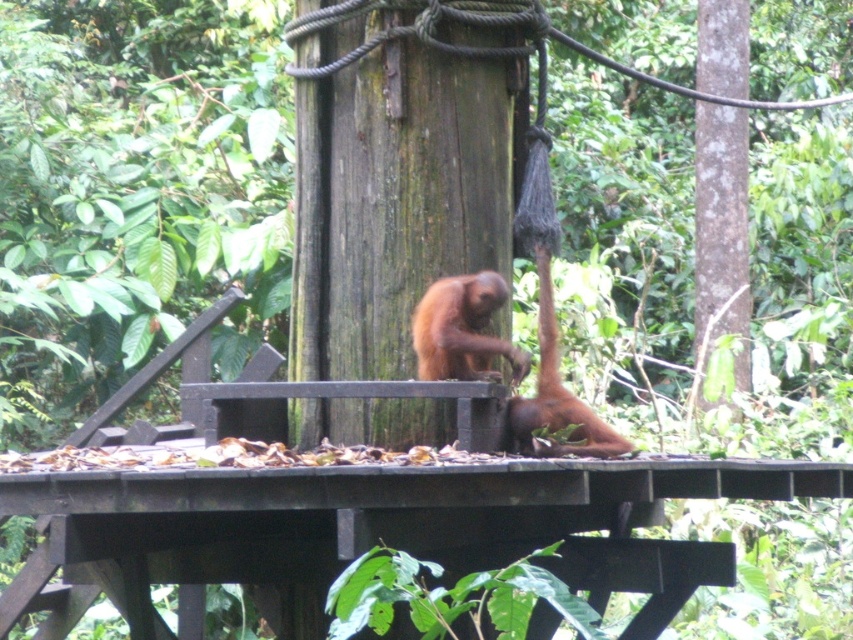
You are a researcher observing the forest scene. You notice an object at coordinates point (462,330). What is located at that point?

The orange fur monkey at center is located at point (462,330).

Looking at this image, you are a visitor at the forest platform and want to take a photo of both monkeys. Which monkey is higher up, the orange fur monkey at center or the brown fur monkey at center?

The orange fur monkey at center is positioned over the brown fur monkey at center, so it is higher up.

You are a wildlife photographer aiming to capture both the orange fur monkey at center and the brown fur monkey at center in the same frame. Based on their positions, which monkey would require you to adjust your camera angle more to include in the shot?

The brown fur monkey at center is hanging upside down from a rope tied around a tall wooden post, so you would need to adjust your camera angle more to include it in the shot compared to the orange fur monkey at center that is sitting upright.